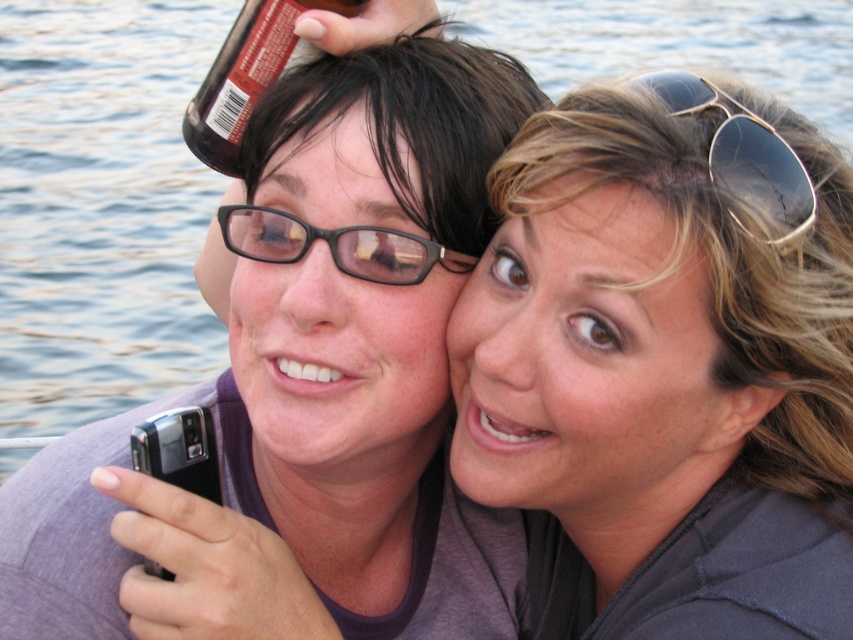
Question: Observing the image, what is the correct spatial positioning of sunglasses at upper right in reference to black plastic glasses at center?

Choices:
 (A) right
 (B) left

Answer: (A)

Question: Which object appears farthest from the camera in this image?

Choices:
 (A) black plastic glasses at center
 (B) brown glass bottle at upper center

Answer: (A)

Question: Which object appears farthest from the camera in this image?

Choices:
 (A) black plastic glasses at center
 (B) blonde hair at upper right

Answer: (A)

Question: Can you confirm if blonde hair at upper right is smaller than brown glass bottle at upper center?

Choices:
 (A) no
 (B) yes

Answer: (A)

Question: Can you confirm if blonde hair at upper right is positioned to the left of sunglasses at upper right?

Choices:
 (A) yes
 (B) no

Answer: (A)

Question: Which point is closer to the camera?

Choices:
 (A) sunglasses at upper right
 (B) matte black phone at center

Answer: (A)